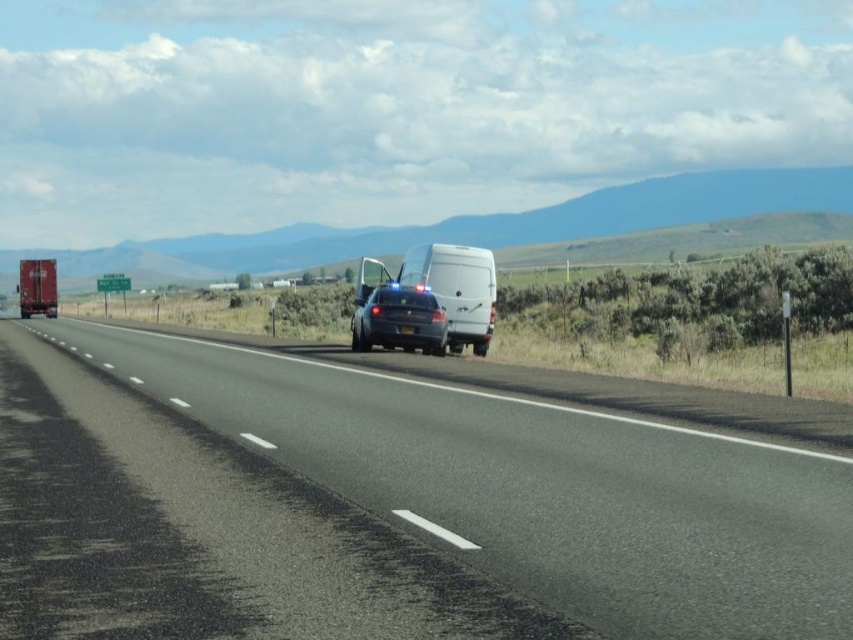
You are a driver approaching the scene and need to determine the safest path. Which object is closer to you, the black asphalt highway at center or the satin black sedan at center?

The black asphalt highway at center is closer to the viewer than the satin black sedan at center, so it is the closer object.

You are a driver approaching the white matte van at center and the satin black sedan at center on the highway. The distance between them is crucial for safe passing. Can your vehicle, which requires a minimum of 5 feet to safely pass between two vehicles, navigate through this gap?

The white matte van at center is 4.81 feet away from the satin black sedan at center. Since your vehicle requires a minimum of 5 feet to safely pass, the gap is insufficient, and attempting to pass would be dangerous.

You are a driver approaching the black asphalt highway at center and the satin black sedan at center. Which object will appear larger in your view as you get closer?

The black asphalt highway at center will appear larger in your view as you get closer because it has a larger size compared to the satin black sedan at center.